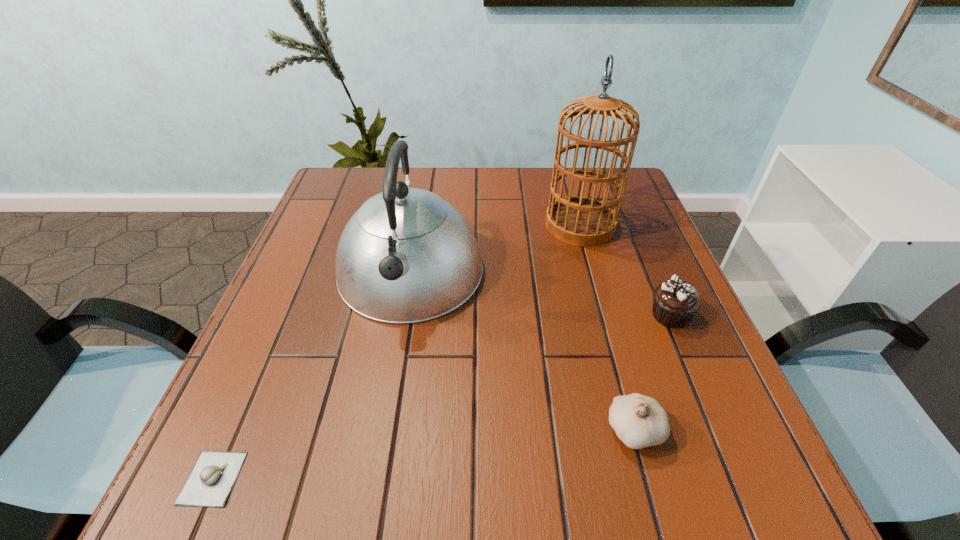
The image size is (960, 540). I want to click on unoccupied position between the taller garlic and the kettle, so click(x=522, y=352).

Locate an element on the screen. free space between the rightmost object and the shortest object is located at coordinates (442, 396).

This screenshot has height=540, width=960. I want to click on free space between the second tallest object and the shorter garlic, so click(311, 375).

At what (x,y) coordinates should I click in order to perform the action: click on free space between the birdcage and the cupcake. Please return your answer as a coordinate pair (x, y). This screenshot has height=540, width=960. Looking at the image, I should click on (625, 270).

Where is `free space between the cupcake and the fourth object from right to left`? The width and height of the screenshot is (960, 540). free space between the cupcake and the fourth object from right to left is located at coordinates (540, 294).

Find the location of a particular element. Image resolution: width=960 pixels, height=540 pixels. vacant area that lies between the tallest object and the cupcake is located at coordinates (625, 270).

Find the location of `empty location between the cupcake and the tallest object`. empty location between the cupcake and the tallest object is located at coordinates (625, 270).

Locate an element on the screen. Image resolution: width=960 pixels, height=540 pixels. blank region between the birdcage and the rightmost object is located at coordinates (625, 270).

Locate an element on the screen. object that stands as the third closest to the kettle is located at coordinates (639, 421).

Select which object appears as the third closest to the taller garlic. Please provide its 2D coordinates. Your answer should be formatted as a tuple, i.e. [(x, y)], where the tuple contains the x and y coordinates of a point satisfying the conditions above.

[(579, 220)]